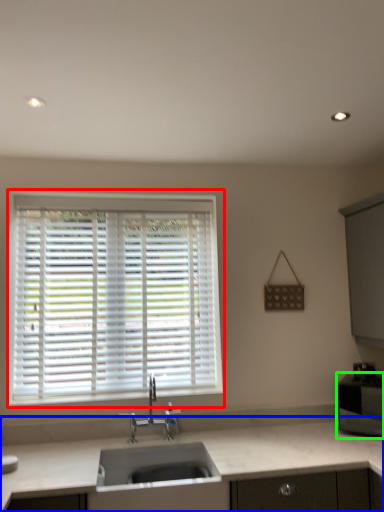
Question: Which object is positioned closest to window (highlighted by a red box)? Select from countertop (highlighted by a blue box) and appliance (highlighted by a green box).

Choices:
 (A) countertop
 (B) appliance

Answer: (A)